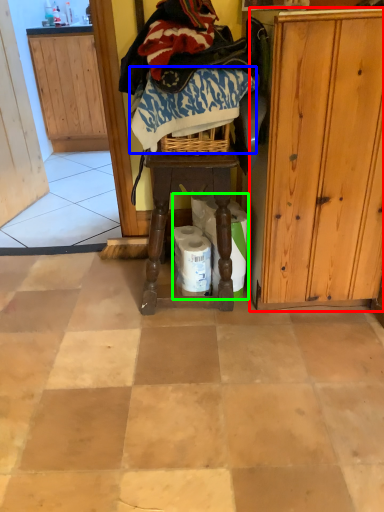
Question: Considering the real-world distances, which object is farthest from cabinetry (highlighted by a red box)? clothing (highlighted by a blue box) or toilet paper (highlighted by a green box)?

Choices:
 (A) clothing
 (B) toilet paper

Answer: (A)